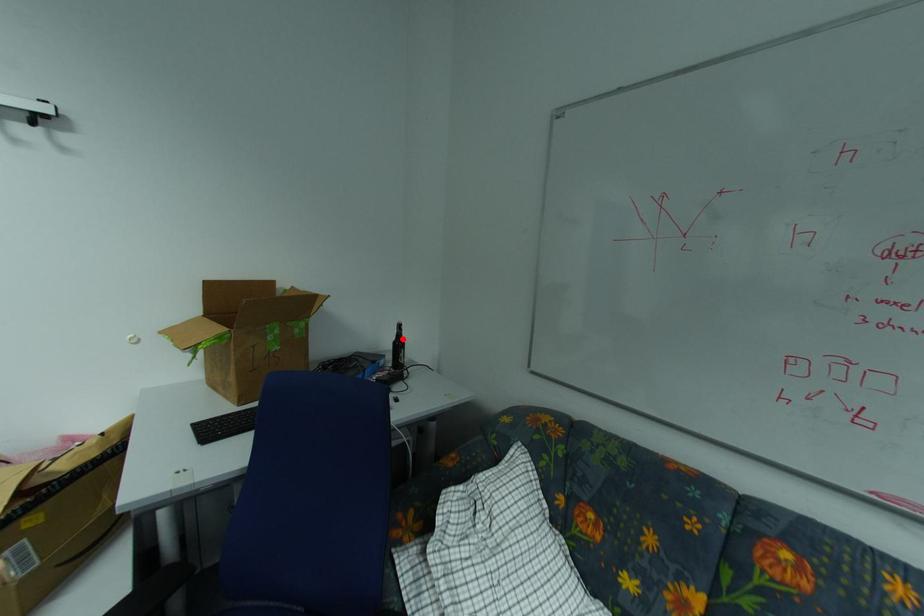
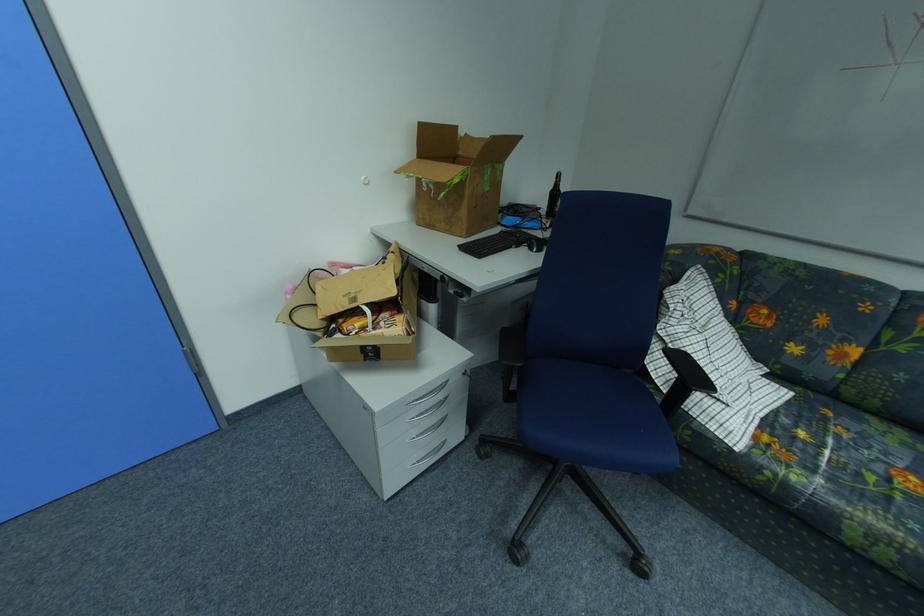
Question: I am providing you with two images of the same scene from different viewpoints. A red point is shown in image1. For the corresponding object point in image2, is it positioned nearer or farther from the camera?

Choices:
 (A) Nearer
 (B) Farther

Answer: (A)